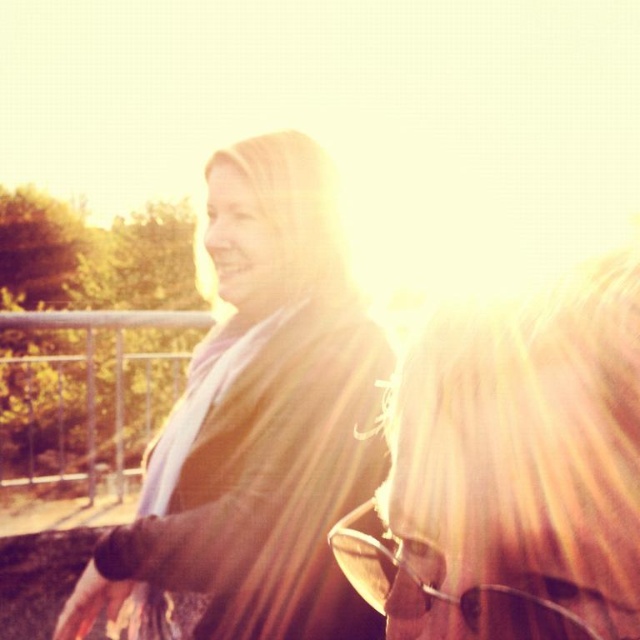
In the scene shown: You are holding a 12 inch ruler and want to measure the distance between yourself and the point at coordinates point (500, 541). Can you reach it with your ruler?

The point at coordinates point (500, 541) is 13.95 inches away from you, so the 12 inch ruler is not long enough to reach it.

You are a photographer trying to adjust the lighting for a portrait. You notice the matte black jacket at center and the blonde hair at upper right in the scene. Which object is positioned higher in the frame?

The matte black jacket at center is located above the blonde hair at upper right, so it is positioned higher in the frame.

In the scene shown: You are a photographer adjusting your camera settings to focus on the matte black jacket at center and sunglasses at center in the image. Which object should you focus on first if you want to ensure both are in sharp focus?

The matte black jacket at center is located above sunglasses at center, so you should focus on the matte black jacket at center first to ensure both are in sharp focus.